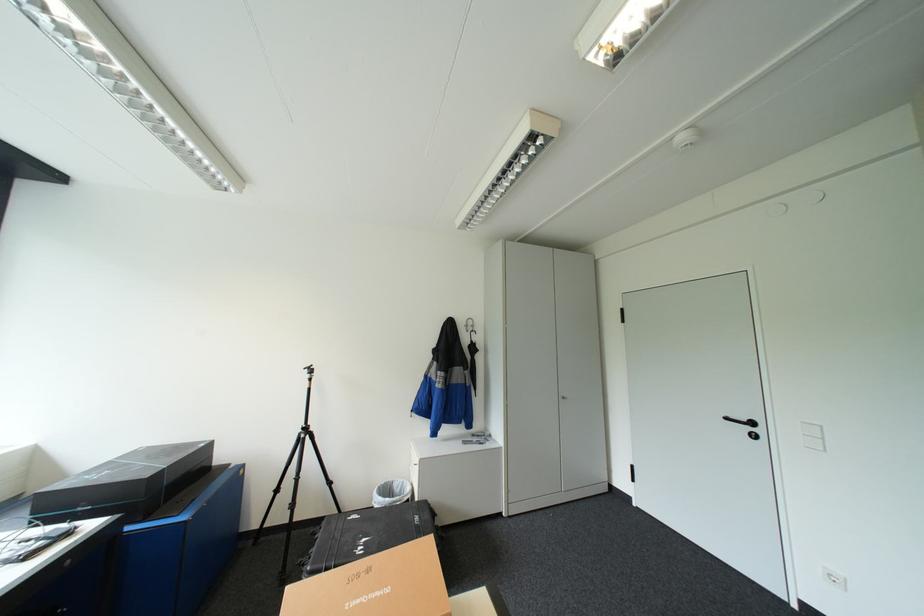
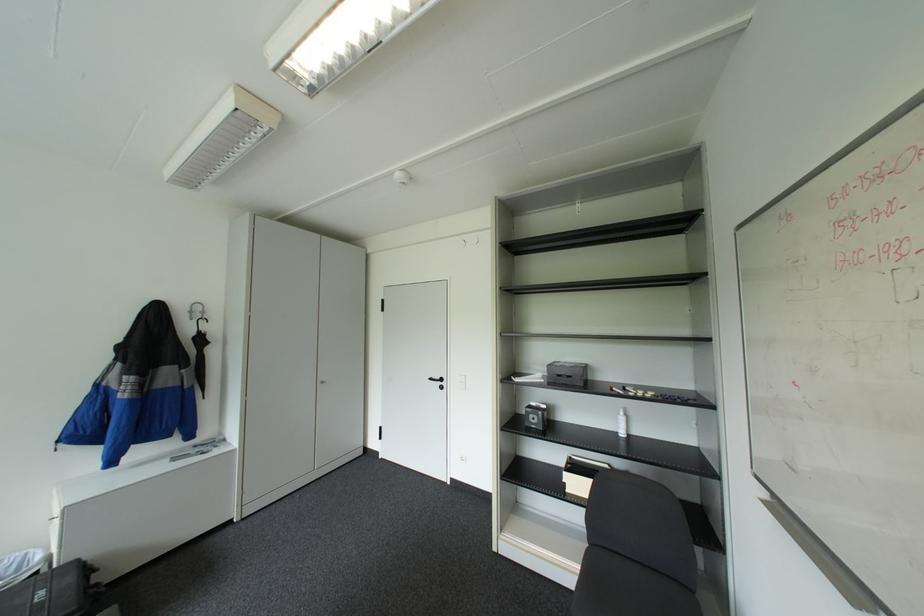
Question: The camera is either moving clockwise (left) or counter-clockwise (right) around the object. The first image is from the beginning of the video and the second image is from the end. Is the camera moving left or right when shooting the video?

Choices:
 (A) Left
 (B) Right

Answer: (A)